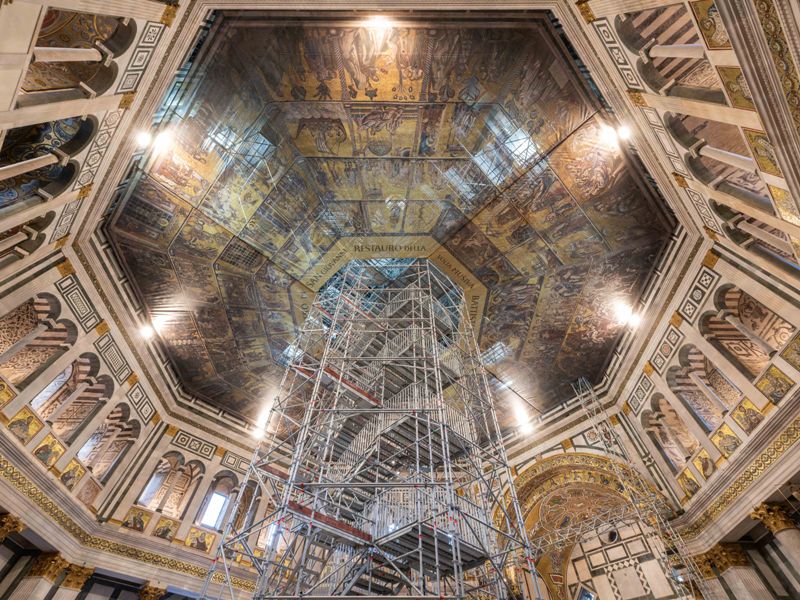
Where is `window`? The image size is (800, 600). window is located at coordinates (50, 390), (89, 446), (150, 488), (214, 507), (265, 540).